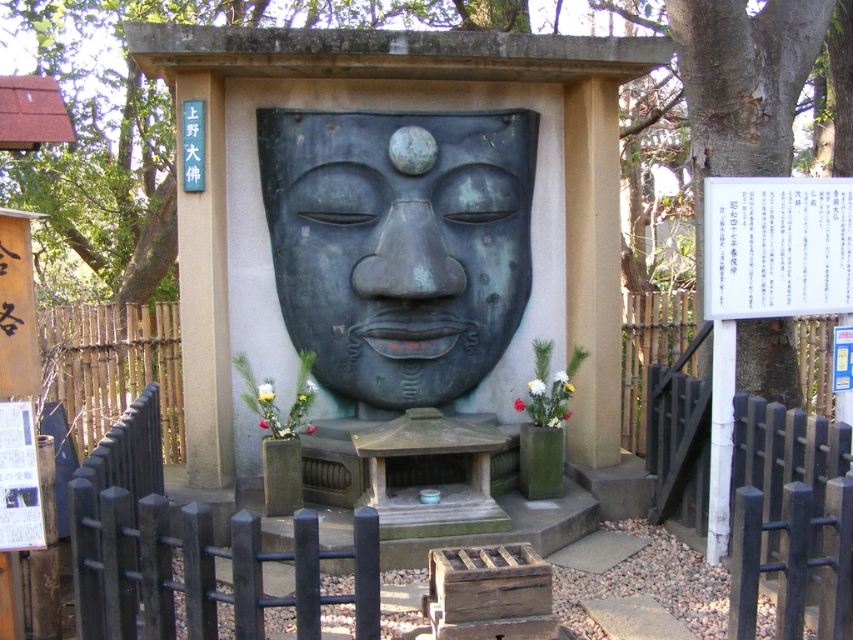
Question: Which point is closer to the camera taking this photo?

Choices:
 (A) (299, 266)
 (B) (839, 474)

Answer: (B)

Question: Which point appears farthest from the camera in this image?

Choices:
 (A) (312, 115)
 (B) (808, 404)

Answer: (B)

Question: Which point is farther to the camera?

Choices:
 (A) (415, 380)
 (B) (639, 400)

Answer: (B)

Question: Is bronze mask at center above black wooden fence at center?

Choices:
 (A) no
 (B) yes

Answer: (B)

Question: Can you confirm if bronze mask at center is positioned below black wooden fence at center?

Choices:
 (A) no
 (B) yes

Answer: (A)

Question: Is bronze mask at center smaller than black wooden fence at center?

Choices:
 (A) no
 (B) yes

Answer: (A)